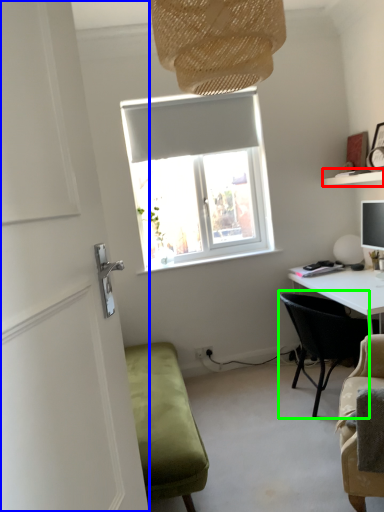
Question: Estimate the real-world distances between objects in this image. Which object is closer to shelf (highlighted by a red box), door (highlighted by a blue box) or chair (highlighted by a green box)?

Choices:
 (A) door
 (B) chair

Answer: (B)